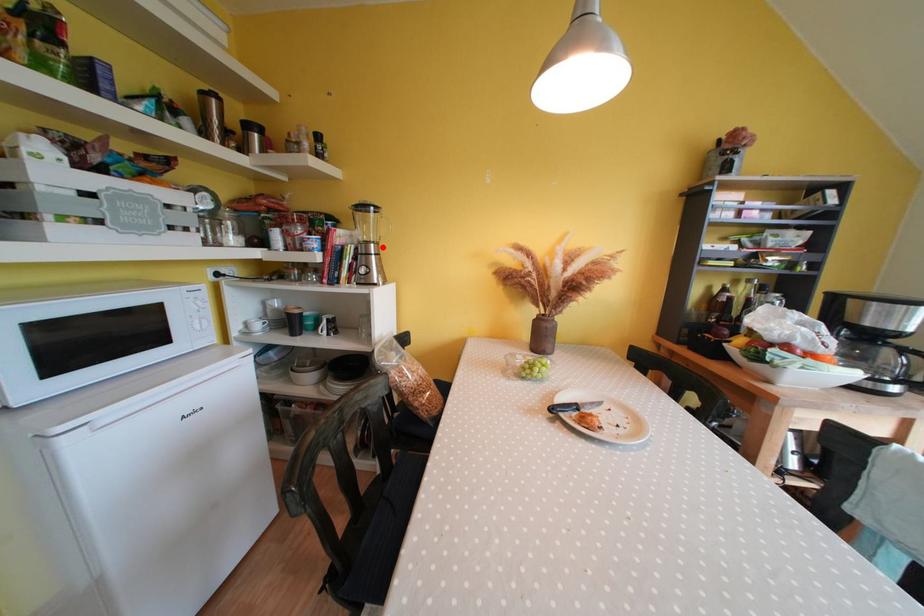
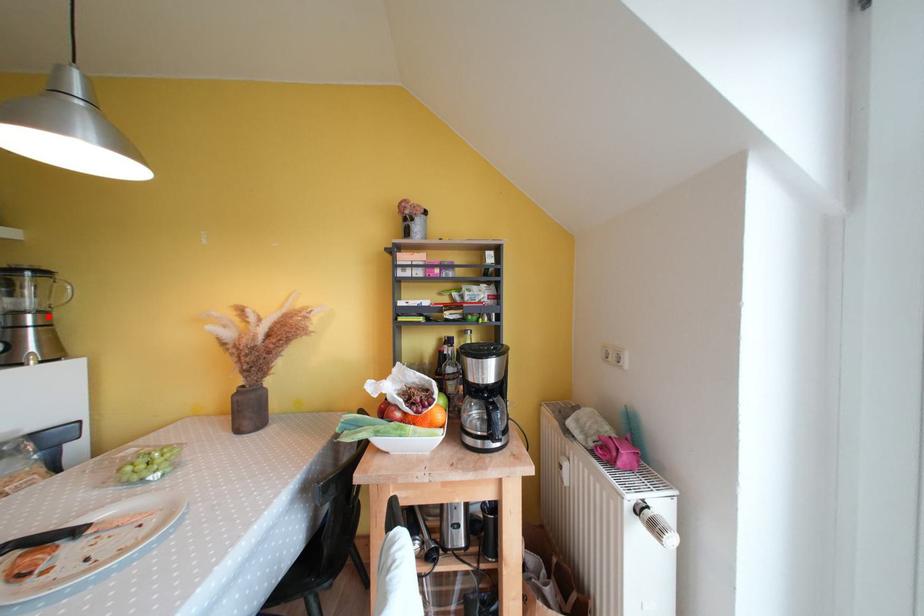
I am providing you with two images of the same scene from different viewpoints. A red point is marked on the first image and another point is marked on the second image. Does the point marked in image1 correspond to the same location as the one in image2?

Yes